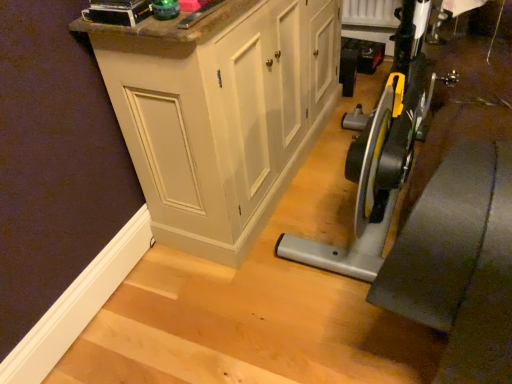
Where is `matte white cabinet at center`? The width and height of the screenshot is (512, 384). matte white cabinet at center is located at coordinates (220, 112).

The image size is (512, 384). What do you see at coordinates (220, 112) in the screenshot?
I see `matte white cabinet at center` at bounding box center [220, 112].

Describe the element at coordinates (167, 22) in the screenshot. I see `green plastic bottle at upper center` at that location.

At what (x,y) coordinates should I click in order to perform the action: click on green plastic bottle at upper center. Please return your answer as a coordinate pair (x, y). Image resolution: width=512 pixels, height=384 pixels. Looking at the image, I should click on (167, 22).

Find the location of a particular element. The height and width of the screenshot is (384, 512). matte white cabinet at center is located at coordinates (220, 112).

Which is more to the right, matte white cabinet at center or green plastic bottle at upper center?

From the viewer's perspective, matte white cabinet at center appears more on the right side.

Is matte white cabinet at center in front of green plastic bottle at upper center?

No, matte white cabinet at center is further to the viewer.

Is point (176, 103) closer or farther from the camera than point (170, 39)?

Clearly, point (176, 103) is more distant from the camera than point (170, 39).

Consider the image. From the image's perspective, is matte white cabinet at center over green plastic bottle at upper center?

Yes.

In the scene shown: From a real-world perspective, does matte white cabinet at center stand above green plastic bottle at upper center?

No.

Which object is thinner, matte white cabinet at center or green plastic bottle at upper center?

green plastic bottle at upper center is thinner.

Who is taller, matte white cabinet at center or green plastic bottle at upper center?

Standing taller between the two is matte white cabinet at center.

Considering the relative sizes of matte white cabinet at center and green plastic bottle at upper center in the image provided, is matte white cabinet at center smaller than green plastic bottle at upper center?

No.

Which is correct: matte white cabinet at center is inside green plastic bottle at upper center, or outside of it?

matte white cabinet at center lies outside green plastic bottle at upper center.

Is matte white cabinet at center beside green plastic bottle at upper center?

matte white cabinet at center is not next to green plastic bottle at upper center, and they're not touching.

Is matte white cabinet at center looking in the opposite direction of green plastic bottle at upper center?

No, matte white cabinet at center is not facing away from green plastic bottle at upper center.

Identify the location of cabinetry that is behind the green plastic bottle at upper center. (220, 112).

Is green plastic bottle at upper center to the left of matte white cabinet at center from the viewer's perspective?

Yes, green plastic bottle at upper center is to the left of matte white cabinet at center.

Who is more distant, green plastic bottle at upper center or matte white cabinet at center?

matte white cabinet at center is behind.

Does point (125, 14) come in front of point (311, 46)?

Yes.

From the image's perspective, is green plastic bottle at upper center above or below matte white cabinet at center?

green plastic bottle at upper center is below matte white cabinet at center.

From a real-world perspective, is green plastic bottle at upper center under matte white cabinet at center?

No, from a real-world perspective, green plastic bottle at upper center is not beneath matte white cabinet at center.

Can you confirm if green plastic bottle at upper center is thinner than matte white cabinet at center?

Yes.

Is green plastic bottle at upper center shorter than matte white cabinet at center?

Indeed, green plastic bottle at upper center has a lesser height compared to matte white cabinet at center.

In terms of size, does green plastic bottle at upper center appear bigger or smaller than matte white cabinet at center?

green plastic bottle at upper center is smaller than matte white cabinet at center.

From the picture: Is green plastic bottle at upper center situated inside matte white cabinet at center or outside?

The correct answer is: outside.

Are green plastic bottle at upper center and matte white cabinet at center located far from each other?

No.

Is matte white cabinet at center at the back of green plastic bottle at upper center?

That's not correct — green plastic bottle at upper center is not looking away from matte white cabinet at center.

Where is `counter top that appears above the matte white cabinet at center (from a real-world perspective)`? counter top that appears above the matte white cabinet at center (from a real-world perspective) is located at coordinates (167, 22).

I want to click on cabinetry located above the green plastic bottle at upper center (from the image's perspective), so click(x=220, y=112).

The width and height of the screenshot is (512, 384). I want to click on cabinetry on the right of green plastic bottle at upper center, so click(x=220, y=112).